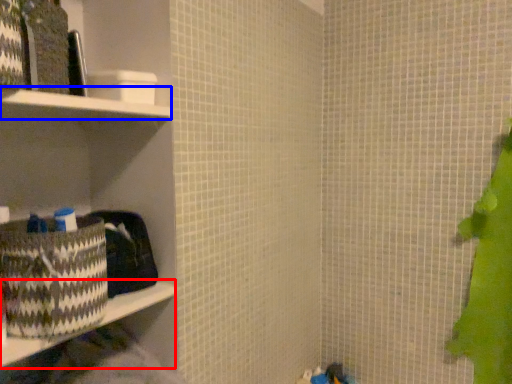
Question: Which object appears farthest to the camera in this image, ledge (highlighted by a red box) or cabinet (highlighted by a blue box)?

Choices:
 (A) ledge
 (B) cabinet

Answer: (A)